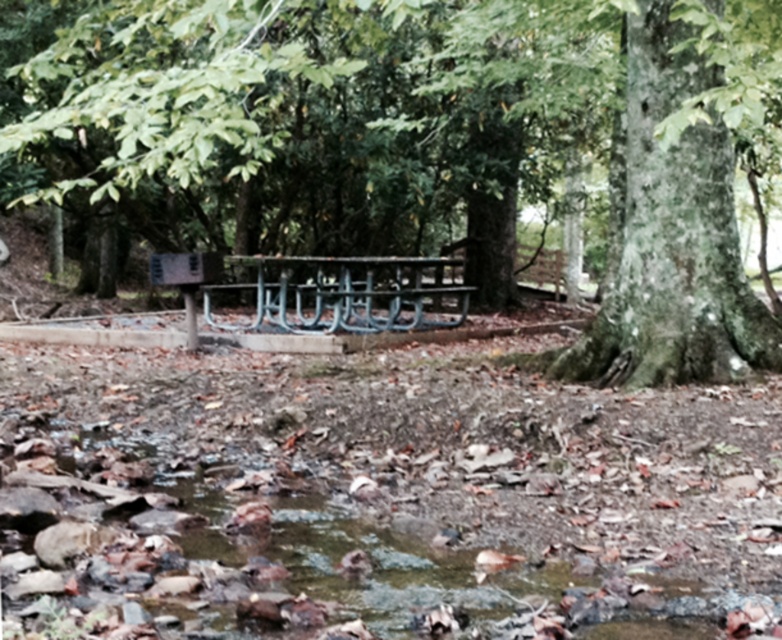
The image size is (782, 640). Describe the element at coordinates (300, 557) in the screenshot. I see `clear water at center` at that location.

Is point (47, 525) farther from viewer compared to point (379, 278)?

No, it is not.

I want to click on clear water at center, so click(x=300, y=557).

Is green rough bark tree at center above clear water at center?

Correct, green rough bark tree at center is located above clear water at center.

Is green rough bark tree at center smaller than clear water at center?

No, green rough bark tree at center is not smaller than clear water at center.

Identify the location of green rough bark tree at center. (415, 145).

Find the location of a particular element. green rough bark tree at center is located at coordinates (415, 145).

Can you confirm if green rough bark tree at center is positioned above green painted metal bench at center?

Correct, green rough bark tree at center is located above green painted metal bench at center.

Is green rough bark tree at center below green painted metal bench at center?

No, green rough bark tree at center is not below green painted metal bench at center.

At what (x,y) coordinates should I click in order to perform the action: click on green rough bark tree at center. Please return your answer as a coordinate pair (x, y). Looking at the image, I should click on (415, 145).